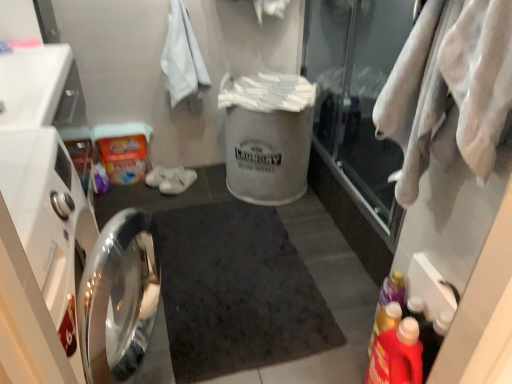
Question: Is transparent glass door at upper right in front of white cotton bath towel at upper left?

Choices:
 (A) yes
 (B) no

Answer: (A)

Question: From a real-world perspective, is transparent glass door at upper right on top of white cotton bath towel at upper left?

Choices:
 (A) yes
 (B) no

Answer: (B)

Question: Does transparent glass door at upper right have a smaller size compared to white cotton bath towel at upper left?

Choices:
 (A) yes
 (B) no

Answer: (B)

Question: Is transparent glass door at upper right placed right next to white cotton bath towel at upper left?

Choices:
 (A) yes
 (B) no

Answer: (B)

Question: Could you tell me if transparent glass door at upper right is turned towards white cotton bath towel at upper left?

Choices:
 (A) yes
 (B) no

Answer: (A)

Question: From a real-world perspective, relative to polished stainless steel dishwasher at left, is white cotton towel at right vertically above or below?

Choices:
 (A) above
 (B) below

Answer: (A)

Question: Is white cotton towel at right to the left or to the right of polished stainless steel dishwasher at left in the image?

Choices:
 (A) left
 (B) right

Answer: (B)

Question: Is white cotton towel at right situated inside polished stainless steel dishwasher at left or outside?

Choices:
 (A) outside
 (B) inside

Answer: (A)

Question: From the image's perspective, is white cotton towel at right located above or below polished stainless steel dishwasher at left?

Choices:
 (A) below
 (B) above

Answer: (B)

Question: Considering the positions of polished stainless steel dishwasher at left and red plastic detergent at lower right, which appears as the first bottle when viewed from the front, in the image, is polished stainless steel dishwasher at left taller or shorter than red plastic detergent at lower right, which appears as the first bottle when viewed from the front,?

Choices:
 (A) tall
 (B) short

Answer: (A)

Question: Does point (56, 99) appear closer or farther from the camera than point (415, 332)?

Choices:
 (A) farther
 (B) closer

Answer: (A)

Question: Relative to red plastic detergent at lower right, the second bottle in the back-to-front sequence, is polished stainless steel dishwasher at left in front or behind?

Choices:
 (A) behind
 (B) front

Answer: (B)

Question: Looking at their shapes, would you say polished stainless steel dishwasher at left is wider or thinner than red plastic detergent at lower right, the second bottle in the back-to-front sequence?

Choices:
 (A) thin
 (B) wide

Answer: (B)

Question: Is dark matte bath mat at center wider or thinner than white fabric bag at center?

Choices:
 (A) thin
 (B) wide

Answer: (B)

Question: From a real-world perspective, is dark matte bath mat at center physically located above or below white fabric bag at center?

Choices:
 (A) below
 (B) above

Answer: (A)